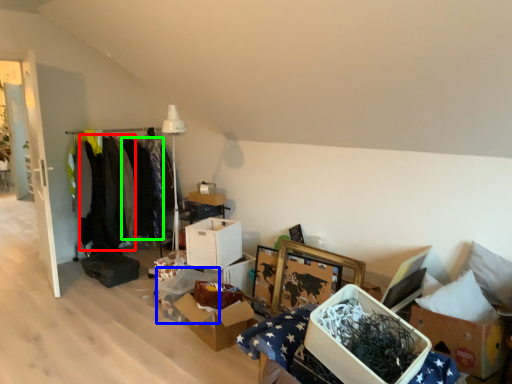
Question: Considering the real-world distances, which object is closest to clothing (highlighted by a red box)? storage box (highlighted by a blue box) or clothing (highlighted by a green box).

Choices:
 (A) storage box
 (B) clothing

Answer: (B)